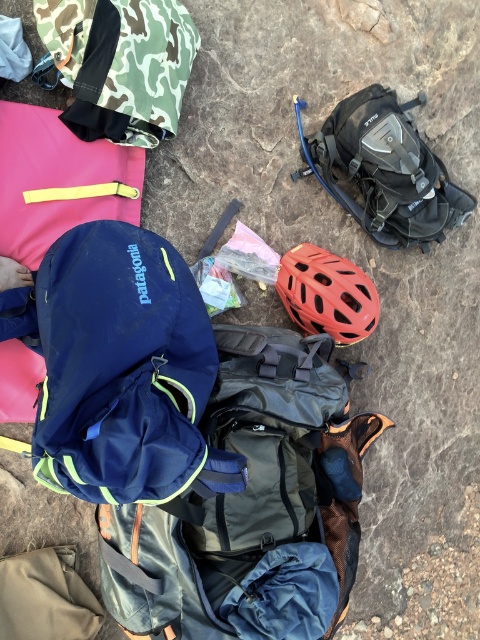
Question: Among these points, which one is nearest to the camera?

Choices:
 (A) (197, 550)
 (B) (307, 317)
 (C) (391, 246)
 (D) (41, 22)

Answer: (A)

Question: Considering the relative positions of navy blue fabric backpack at center and matte red helmet at center in the image provided, where is navy blue fabric backpack at center located with respect to matte red helmet at center?

Choices:
 (A) above
 (B) below

Answer: (B)

Question: Based on their relative distances, which object is farther from the black matte hydration backpack at upper right?

Choices:
 (A) matte red helmet at center
 (B) camo fabric backpack at upper left
 (C) navy blue fabric backpack at center

Answer: (C)

Question: Which object appears farthest from the camera in this image?

Choices:
 (A) matte red helmet at center
 (B) camo fabric backpack at upper left

Answer: (A)

Question: Can you confirm if navy blue fabric backpack at center is positioned above matte red helmet at center?

Choices:
 (A) no
 (B) yes

Answer: (A)

Question: Can you confirm if navy blue fabric backpack at center is smaller than camo fabric backpack at upper left?

Choices:
 (A) yes
 (B) no

Answer: (B)